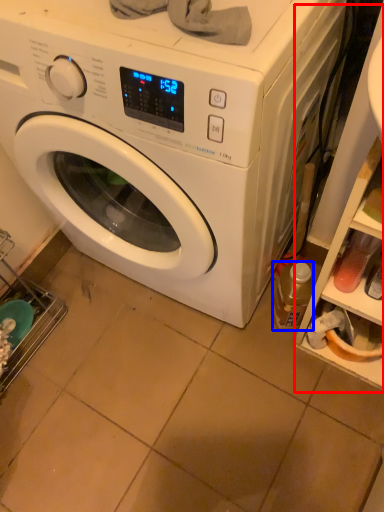
Question: Which object appears farthest to the camera in this image, shelf (highlighted by a red box) or bottle (highlighted by a blue box)?

Choices:
 (A) shelf
 (B) bottle

Answer: (B)